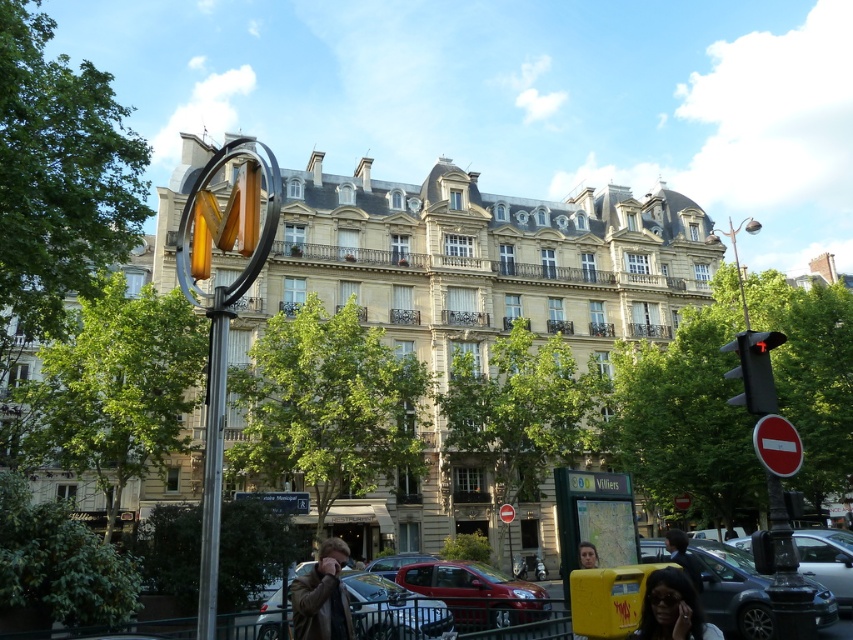
Question: Does silver metallic pole at center have a greater width compared to red matte traffic light at right?

Choices:
 (A) yes
 (B) no

Answer: (A)

Question: Which point is closer to the camera?

Choices:
 (A) (200, 612)
 (B) (641, 544)
 (C) (669, 577)

Answer: (A)

Question: Observing the image, what is the correct spatial positioning of metallic red car at center in reference to brown leather jacket at lower center?

Choices:
 (A) right
 (B) left

Answer: (A)

Question: Which point appears closest to the camera in this image?

Choices:
 (A) (695, 580)
 (B) (664, 193)

Answer: (A)

Question: Which point is farther from the camera taking this photo?

Choices:
 (A) (216, 298)
 (B) (473, 259)
 (C) (421, 636)

Answer: (B)

Question: Is metallic red car at center smaller than metallic rectangular sign at lower center?

Choices:
 (A) no
 (B) yes

Answer: (A)